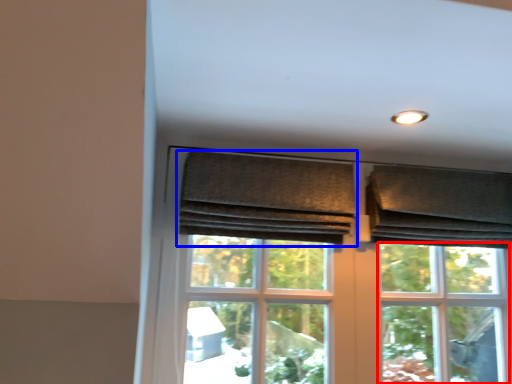
Question: Which object is further to the camera taking this photo, bay window (highlighted by a red box) or curtain (highlighted by a blue box)?

Choices:
 (A) bay window
 (B) curtain

Answer: (A)